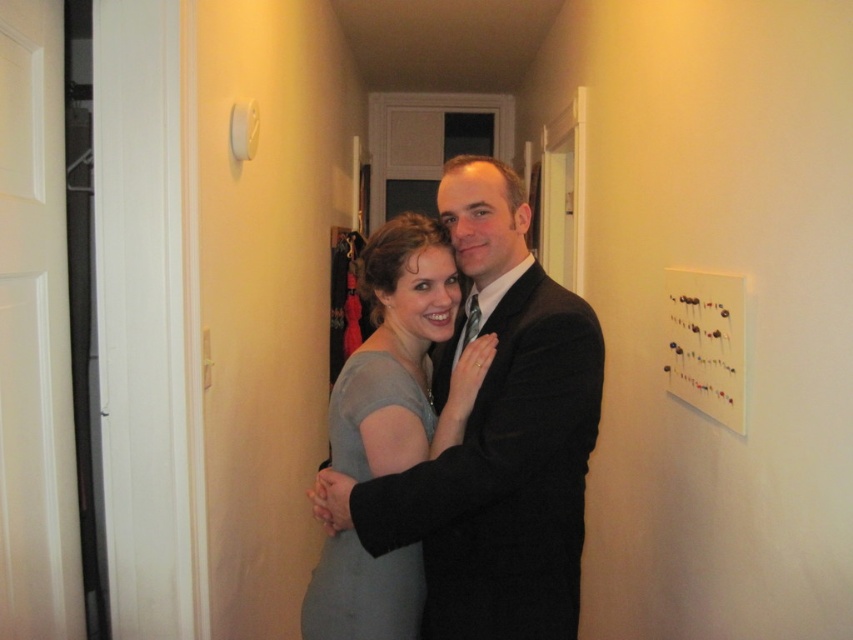
You are a fashion designer observing the scene in the hallway. You notice two dresses labeled as the matte gray dress at center and the gray matte dress at center. Which one is taller?

The matte gray dress at center is taller than the gray matte dress at center.

You are standing in the hallway and want to touch the gray matte dress at center. The point you need to reach is located at coordinates point (363,593). Is this point on the gray matte dress at center?

Yes, the point (363,593) is on the gray matte dress at center according to the description.

Looking at this image, you are an interior designer planning to hang a decorative mirror on the wall in this hallway. The mirror is 1.2 meters wide. The gray matte dress at center and white matte bulletin board at upper right are currently occupying space on the wall. Can you place the mirror between them without overlapping either object?

The gray matte dress at center is positioned on the left side of white matte bulletin board at upper right. Since the mirror is 1.2 meters wide, you can place it between them as long as there is sufficient space between the two objects to accommodate the mirror without overlapping.